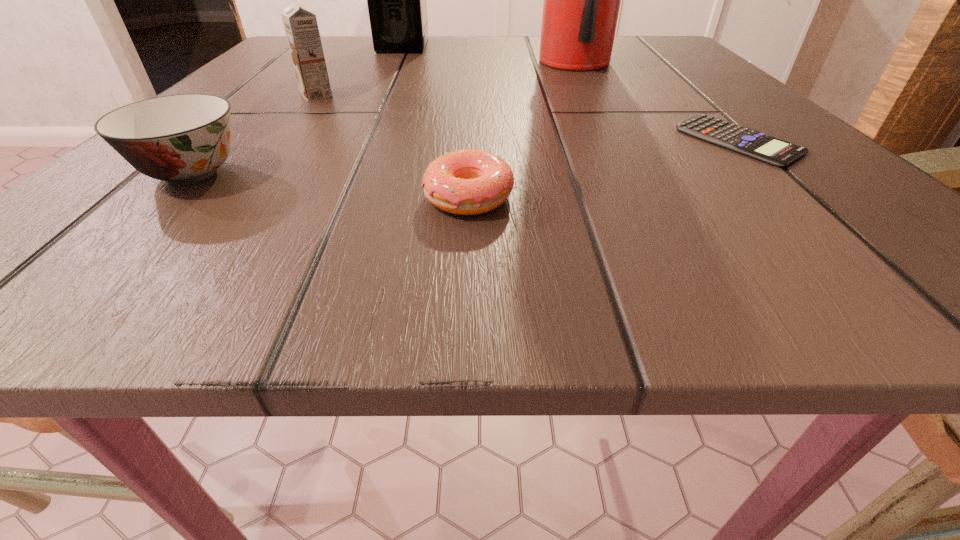
Locate an element on the screen. The width and height of the screenshot is (960, 540). free point between the soup bowl and the fifth object from left to right is located at coordinates (383, 117).

This screenshot has height=540, width=960. In order to click on free area in between the third tallest object and the rightmost object in this screenshot , I will do `click(528, 118)`.

At what (x,y) coordinates should I click in order to perform the action: click on blank region between the fire extinguisher and the shortest object. Please return your answer as a coordinate pair (x, y). The width and height of the screenshot is (960, 540). Looking at the image, I should click on (657, 101).

The width and height of the screenshot is (960, 540). Identify the location of free area in between the second shortest object and the fifth object from left to right. (520, 129).

Locate an element on the screen. This screenshot has width=960, height=540. free space between the third farthest object and the rightmost object is located at coordinates (528, 118).

Find the location of a particular element. The height and width of the screenshot is (540, 960). free point between the fifth tallest object and the liquor is located at coordinates (435, 122).

Find the location of a particular element. This screenshot has width=960, height=540. unoccupied area between the second shortest object and the soup bowl is located at coordinates (330, 185).

You are a GUI agent. You are given a task and a screenshot of the screen. Output one action in this format:
    pyautogui.click(x=<x>, y=<y>)
    Task: Click on the object that stands as the second closest to the soup bowl
    This screenshot has width=960, height=540.
    Given the screenshot: What is the action you would take?
    pyautogui.click(x=467, y=182)

Where is `object that is the second closest to the liquor`? This screenshot has width=960, height=540. object that is the second closest to the liquor is located at coordinates (581, 5).

The width and height of the screenshot is (960, 540). In order to click on free location that satisfies the following two spatial constraints: 1. on the back side of the rightmost object; 2. on the front label of the liquor in this screenshot , I will do `click(639, 45)`.